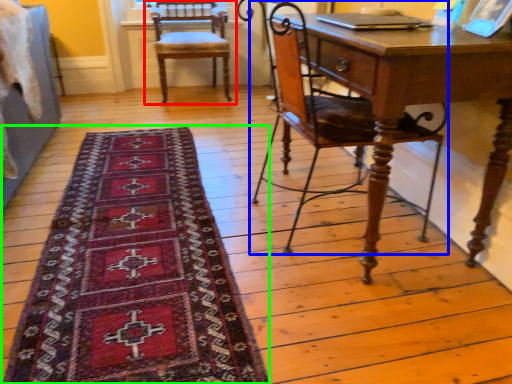
Question: Which is nearer to the chair (highlighted by a red box)? chair (highlighted by a blue box) or mat (highlighted by a green box).

Choices:
 (A) chair
 (B) mat

Answer: (A)